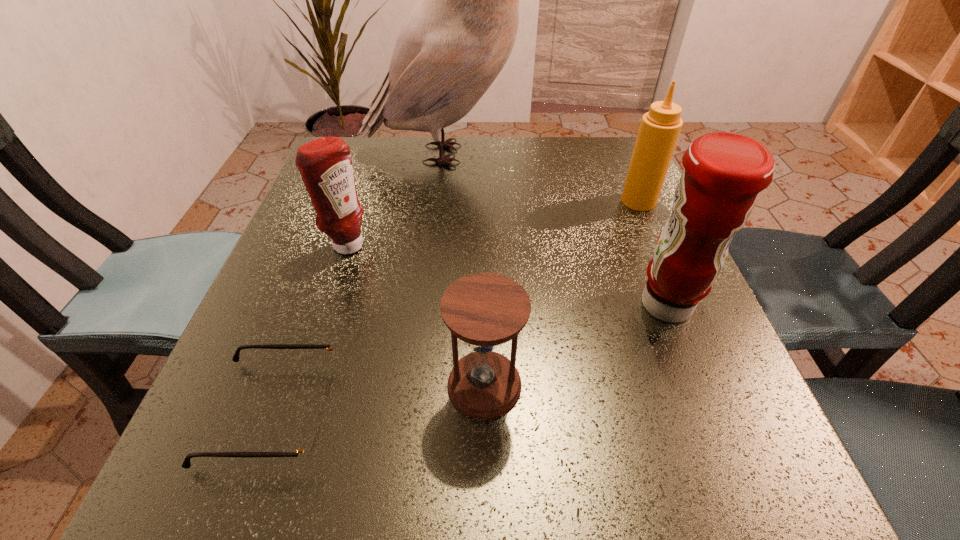
Image resolution: width=960 pixels, height=540 pixels. In order to click on free location that satisfies the following two spatial constraints: 1. on the back side of the second shortest object; 2. on the face of the parakeet in this screenshot , I will do `click(483, 154)`.

Locate an element on the screen. This screenshot has width=960, height=540. free space that satisfies the following two spatial constraints: 1. on the back side of the hourglass; 2. on the face of the parakeet is located at coordinates (483, 154).

This screenshot has width=960, height=540. I want to click on vacant space that satisfies the following two spatial constraints: 1. on the front side of the third shortest object; 2. at the hinge ends of the shortest object, so (291, 413).